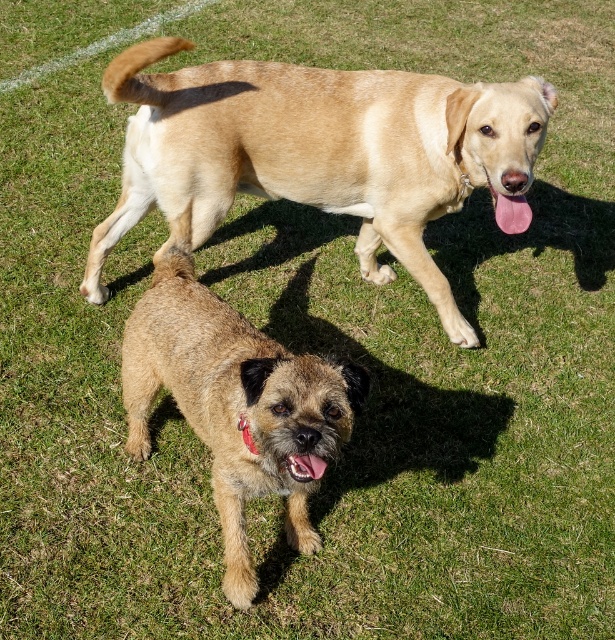
You are a photographer taking a picture of the two dogs in the grassy field. You notice a light brown fur at upper center. Where exactly is this fur located in relation to the two dogs?

The light brown fur at upper center is located at point (x=322, y=152).

You are a photographer trying to capture a clear shot of the pink glossy tongue at lower center without the brown shaggy dog at center blocking it. Is this possible given their positions?

The brown shaggy dog at center is positioned over the pink glossy tongue at lower center, so it would block the view of the pink glossy tongue at lower center. To capture a clear shot of the pink glossy tongue at lower center, you would need to adjust the angle or position to avoid the brown shaggy dog at center.